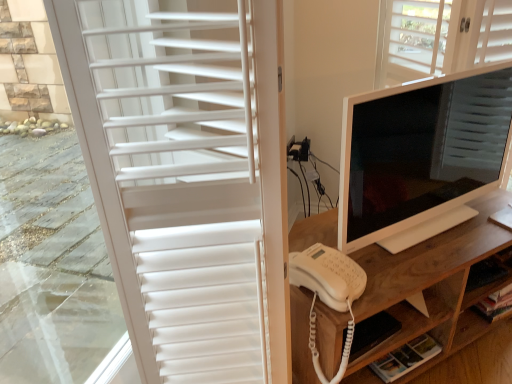
The height and width of the screenshot is (384, 512). Find the location of `empty space that is in between white plastic telephone at center and white glossy monitor at center`. empty space that is in between white plastic telephone at center and white glossy monitor at center is located at coordinates (416, 249).